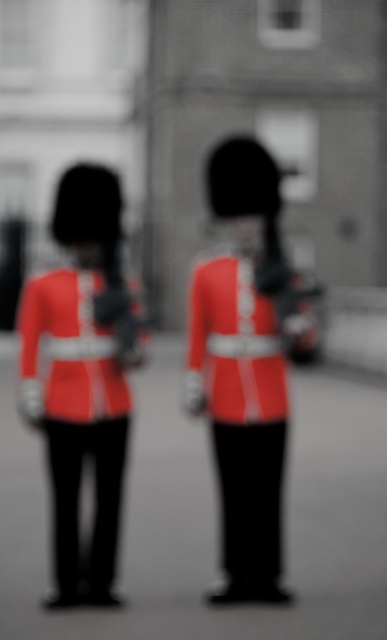
Question: Can you confirm if matte red uniform at center is positioned above matte red uniform at left?

Choices:
 (A) yes
 (B) no

Answer: (A)

Question: Can you confirm if matte red uniform at center is positioned below matte red uniform at left?

Choices:
 (A) no
 (B) yes

Answer: (A)

Question: Where is matte red uniform at center located in relation to matte red uniform at left in the image?

Choices:
 (A) above
 (B) below

Answer: (A)